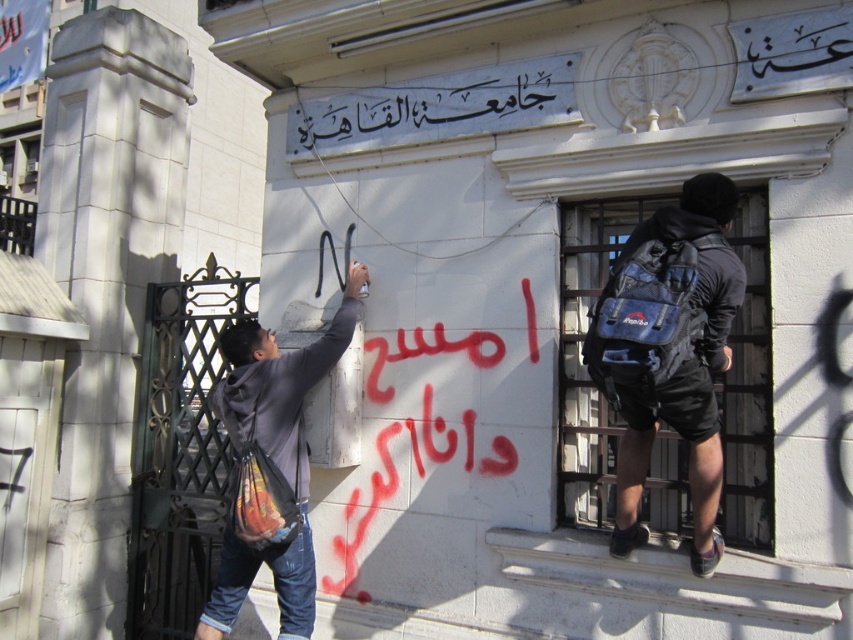
Does dark blue backpack at right have a greater height compared to dark gray hoodie at left?

In fact, dark blue backpack at right may be shorter than dark gray hoodie at left.

Does point (724, 330) lie behind point (234, 337)?

No, (724, 330) is in front of (234, 337).

At what (x,y) coordinates should I click in order to perform the action: click on dark blue backpack at right. Please return your answer as a coordinate pair (x, y). Image resolution: width=853 pixels, height=640 pixels. Looking at the image, I should click on (672, 355).